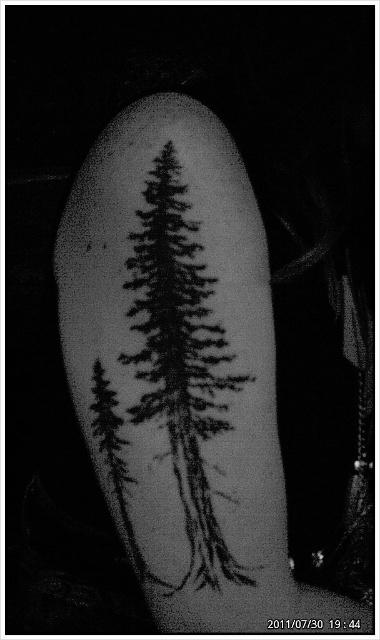
Question: Is black ink tattoo at center to the right of black ink tree at center from the viewer's perspective?

Choices:
 (A) yes
 (B) no

Answer: (A)

Question: Is black ink tattoo at center behind black ink tree at center?

Choices:
 (A) no
 (B) yes

Answer: (A)

Question: Which point is closer to the camera taking this photo?

Choices:
 (A) (218, 579)
 (B) (131, 410)

Answer: (A)

Question: Which object is closer to the camera taking this photo?

Choices:
 (A) black ink tattoo at center
 (B) black ink tree at center

Answer: (A)

Question: Which object is closer to the camera taking this photo?

Choices:
 (A) black ink tattoo at center
 (B) black ink tree at center

Answer: (A)

Question: Can you confirm if black ink tattoo at center is positioned below black ink tree at center?

Choices:
 (A) yes
 (B) no

Answer: (B)